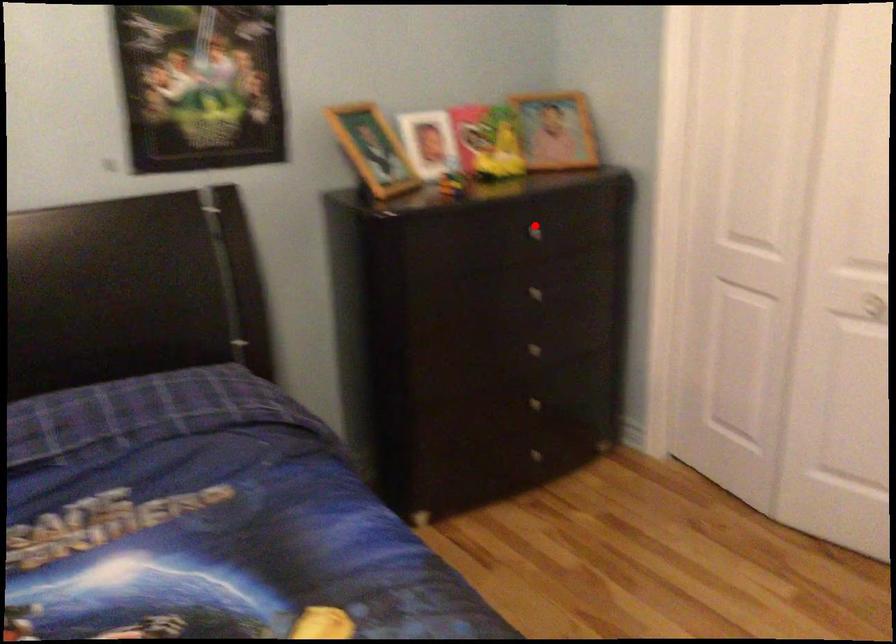
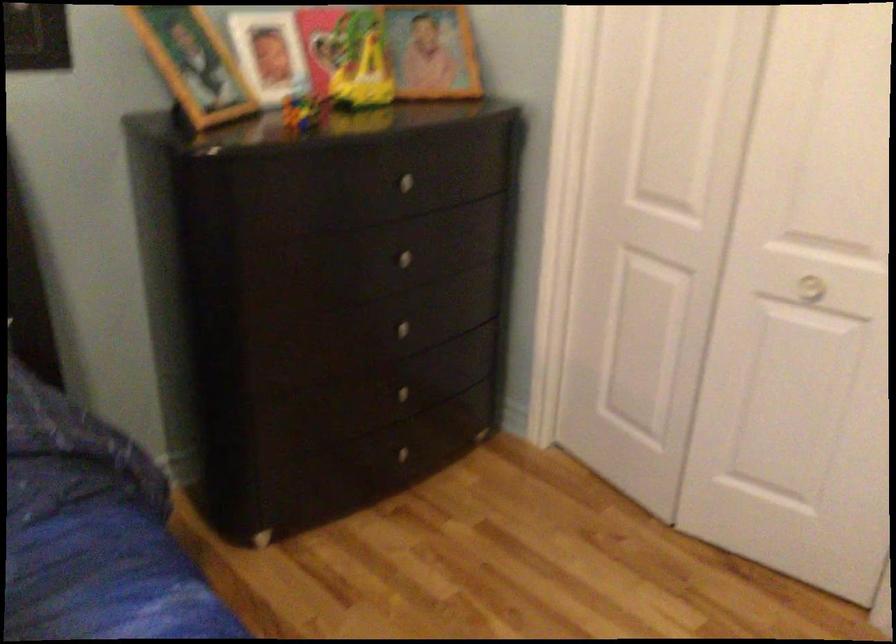
Question: I am providing you with two images of the same scene from different viewpoints. In image1, a red point is highlighted. Considering the same 3D point in image2, which of the following is correct?

Choices:
 (A) It is closer
 (B) It is farther

Answer: (A)